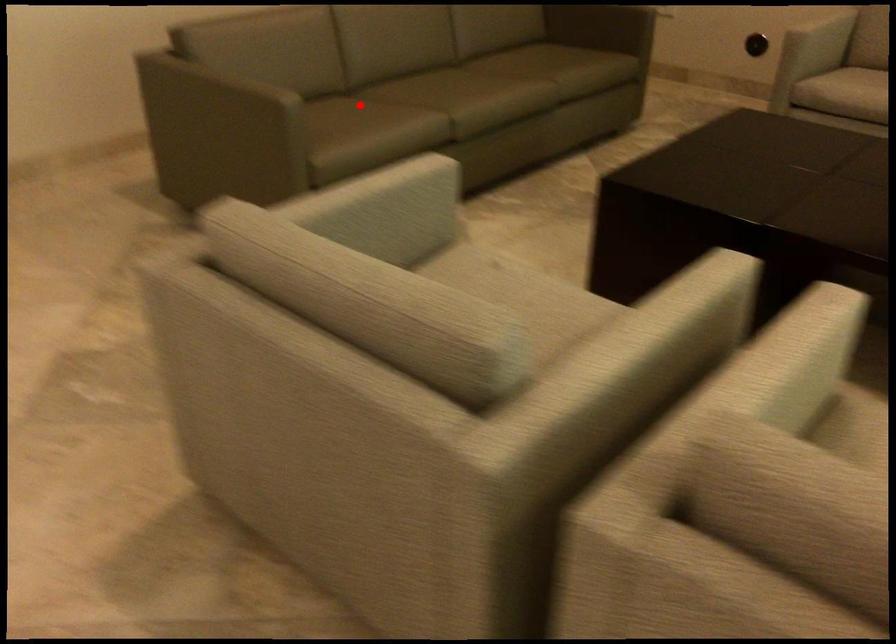
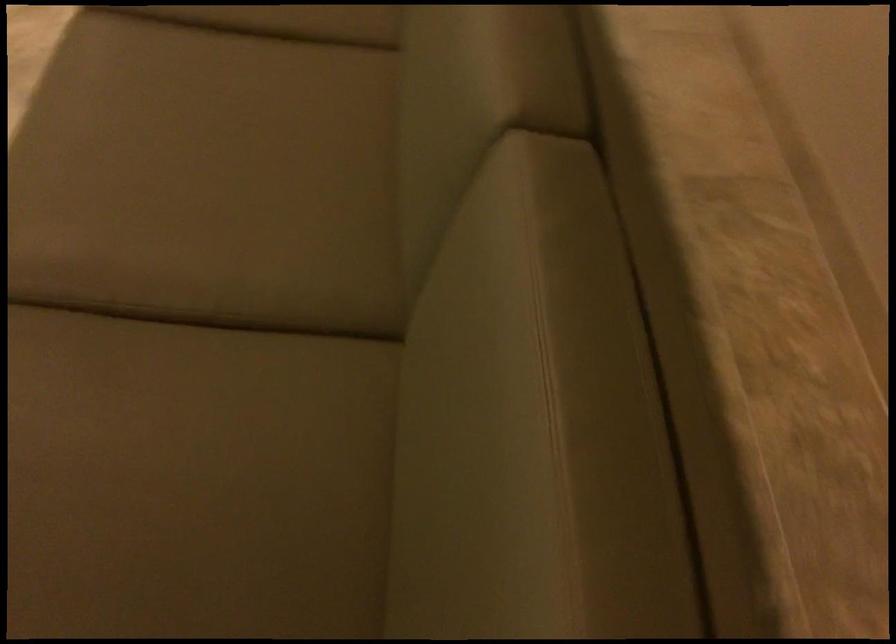
Locate, in the second image, the point that corresponds to the highlighted location in the first image.

(286, 20)